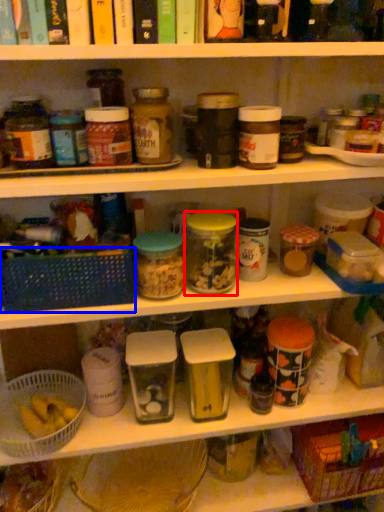
Question: Which object is closer to the camera taking this photo, glass jar (highlighted by a red box) or basket (highlighted by a blue box)?

Choices:
 (A) glass jar
 (B) basket

Answer: (B)